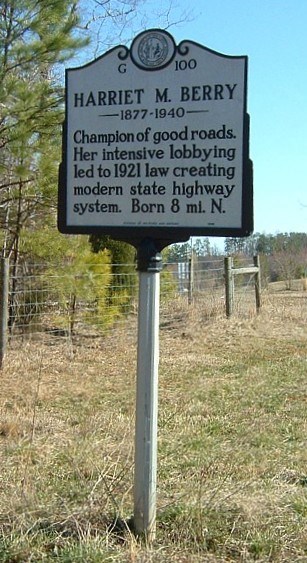
Where is `curl decorations on top of sign`? The image size is (307, 563). curl decorations on top of sign is located at coordinates (125, 55), (179, 48).